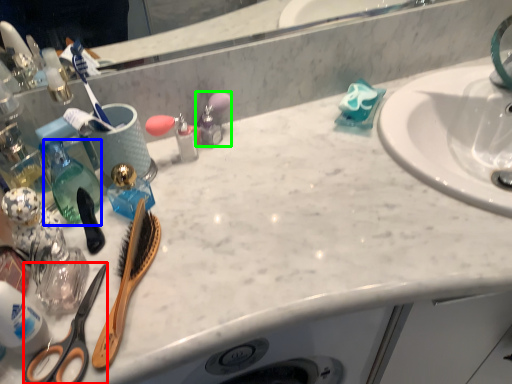
Question: Which object is the farthest from scissors (highlighted by a red box)? Choose among these: bottle (highlighted by a blue box) or toiletry (highlighted by a green box).

Choices:
 (A) bottle
 (B) toiletry

Answer: (B)